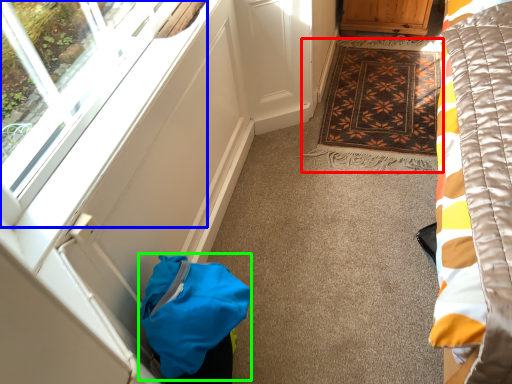
Question: Which is nearer to the mat (highlighted by a red box)? window (highlighted by a blue box) or bag (highlighted by a green box).

Choices:
 (A) window
 (B) bag

Answer: (A)